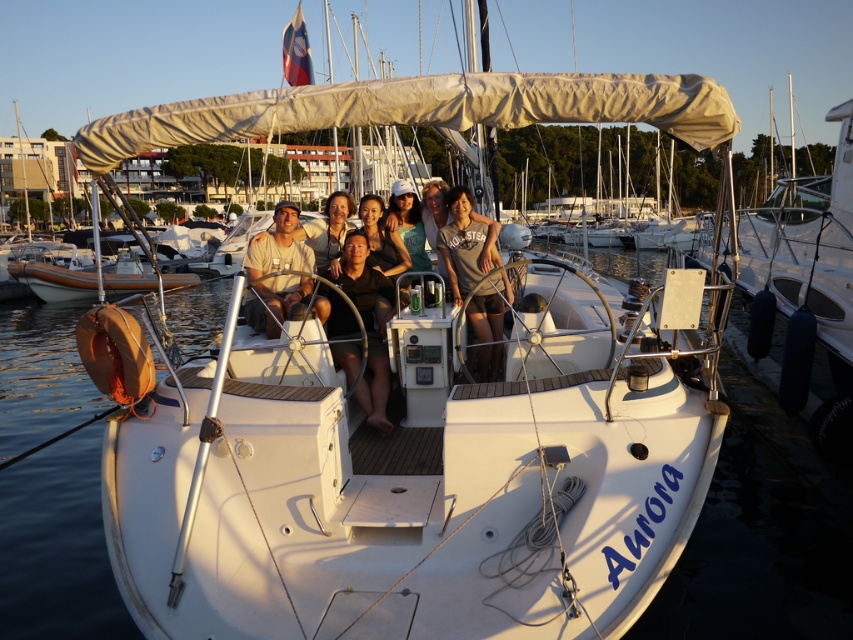
You are a photographer planning to take a group photo of the people on the boat. The white matte boat at right and the matte beige shirt at center are both in the frame. Considering their sizes, which object should you focus on to ensure both are clearly visible in the photo?

The white matte boat at right is larger than the matte beige shirt at center, so focusing on the boat will ensure both objects are clearly visible in the photo.

What object is located at the coordinate point (807, 246) on the image?

The point (807, 246) marks the white matte boat at right.